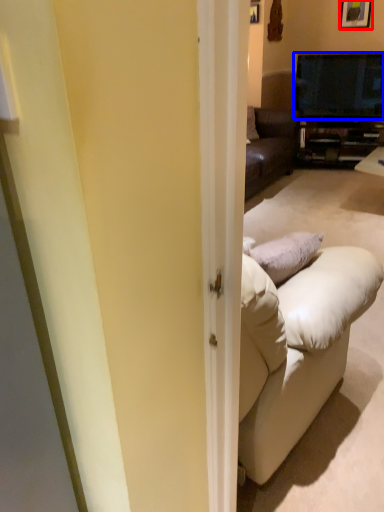
Question: Among these objects, which one is nearest to the camera, picture frame (highlighted by a red box) or television (highlighted by a blue box)?

Choices:
 (A) picture frame
 (B) television

Answer: (B)